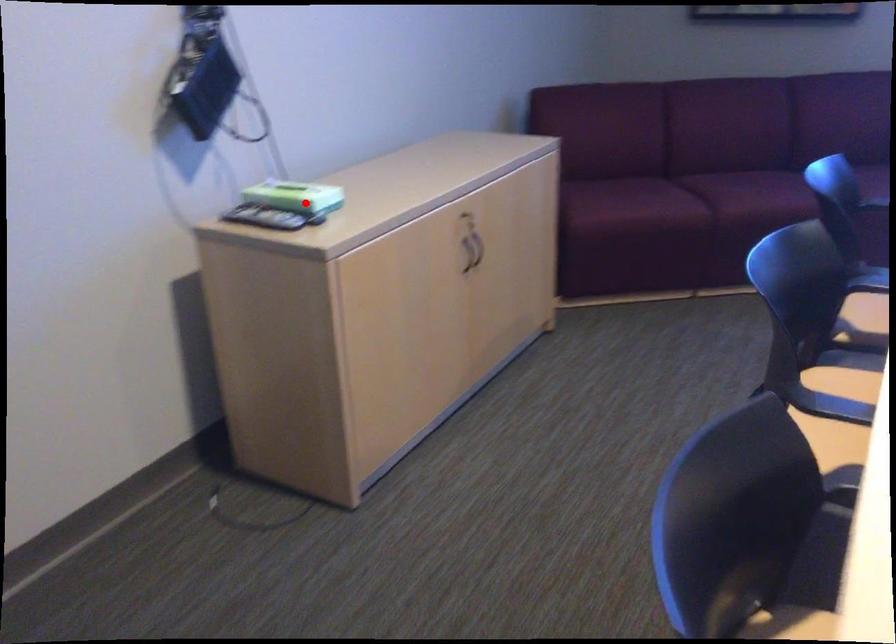
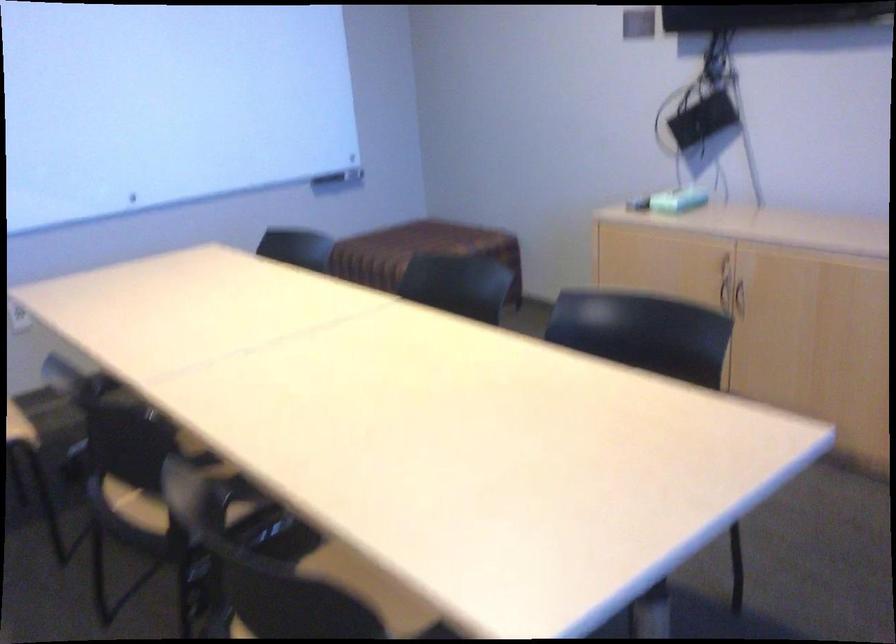
Question: A red point is marked in image1. In image2, is the corresponding 3D point closer to the camera or farther? Reply with the corresponding letter.

Choices:
 (A) The corresponding 3D point is closer.
 (B) The corresponding 3D point is farther.

Answer: (B)